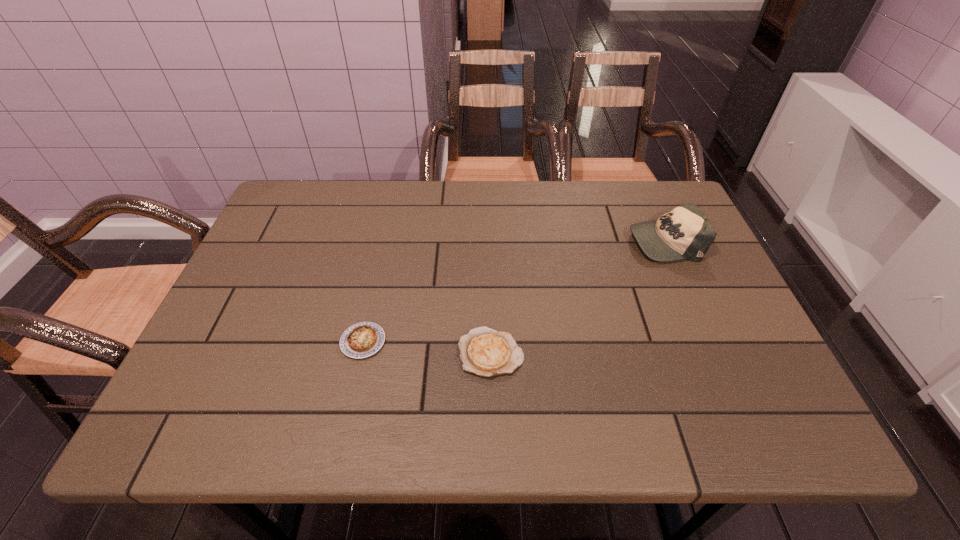
Where is `object present at the right edge`? The height and width of the screenshot is (540, 960). object present at the right edge is located at coordinates (683, 233).

Locate an element on the screen. The height and width of the screenshot is (540, 960). object present at the far right corner is located at coordinates (683, 233).

Image resolution: width=960 pixels, height=540 pixels. What are the coordinates of `blank space at the far edge` in the screenshot? It's located at (515, 195).

I want to click on vacant space at the near edge of the desktop, so click(536, 437).

In the image, there is a desktop. What are the coordinates of `free space at the left edge` in the screenshot? It's located at (309, 239).

I want to click on vacant space at the right edge, so click(696, 326).

In the image, there is a desktop. Where is `free space at the far left corner`? This screenshot has width=960, height=540. free space at the far left corner is located at coordinates (338, 183).

I want to click on free space at the near left corner of the desktop, so click(195, 408).

Find the location of `free space at the far right corner of the desktop`. free space at the far right corner of the desktop is located at coordinates (655, 197).

Image resolution: width=960 pixels, height=540 pixels. I want to click on vacant area that lies between the tallest object and the right quiche, so click(578, 297).